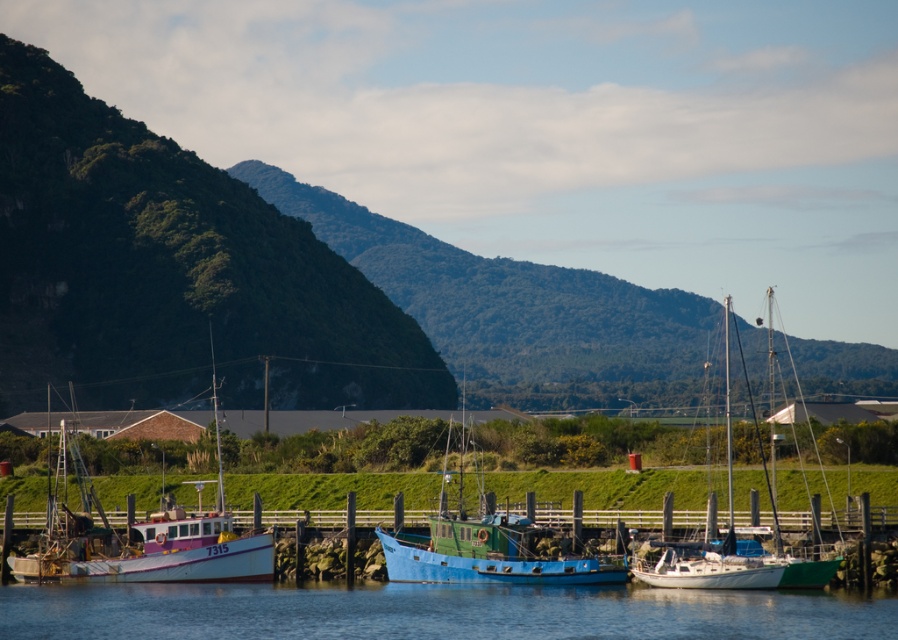
Does green forested mountain at upper left have a lesser width compared to white matte sailboat at center?

In fact, green forested mountain at upper left might be wider than white matte sailboat at center.

The height and width of the screenshot is (640, 898). Describe the element at coordinates (267, 280) in the screenshot. I see `green forested mountain at upper left` at that location.

Where is `green forested mountain at upper left`? Image resolution: width=898 pixels, height=640 pixels. green forested mountain at upper left is located at coordinates (267, 280).

Between blue water at center and white matte sailboat at center, which one appears on the right side from the viewer's perspective?

From the viewer's perspective, white matte sailboat at center appears more on the right side.

Looking at this image, is blue water at center taller than white matte sailboat at center?

No.

Is point (51, 593) positioned in front of point (725, 340)?

Yes, point (51, 593) is closer to viewer.

At what (x,y) coordinates should I click in order to perform the action: click on blue water at center. Please return your answer as a coordinate pair (x, y). The width and height of the screenshot is (898, 640). Looking at the image, I should click on (434, 612).

Between point (34, 369) and point (248, 625), which one is positioned in front?

Point (248, 625)

Between point (81, 225) and point (251, 608), which one is positioned behind?

Point (81, 225)

This screenshot has height=640, width=898. I want to click on green forested mountain at upper left, so click(x=267, y=280).